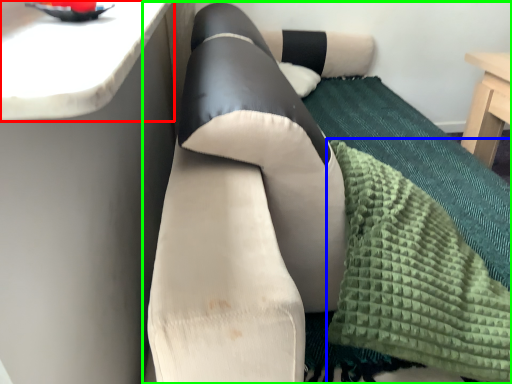
Question: Considering the real-world distances, which object is closest to counter top (highlighted by a red box)? blanket (highlighted by a blue box) or studio couch (highlighted by a green box).

Choices:
 (A) blanket
 (B) studio couch

Answer: (B)